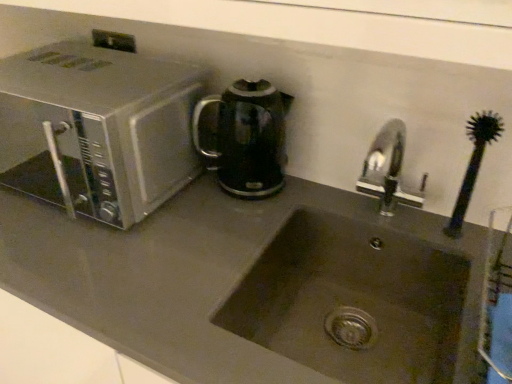
I want to click on vacant space in front of silver metallic microwave at left, so click(102, 275).